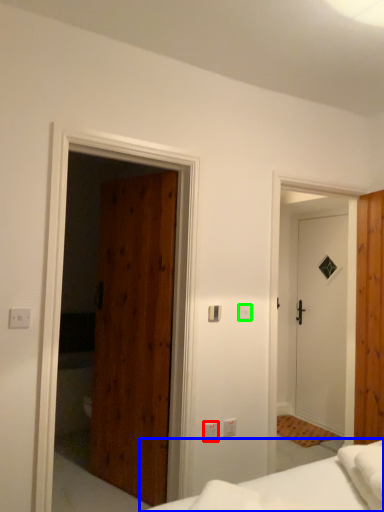
Question: Which object is positioned closest to light switch (highlighted by a red box)? Select from bed (highlighted by a blue box) and light switch (highlighted by a green box).

Choices:
 (A) bed
 (B) light switch

Answer: (B)